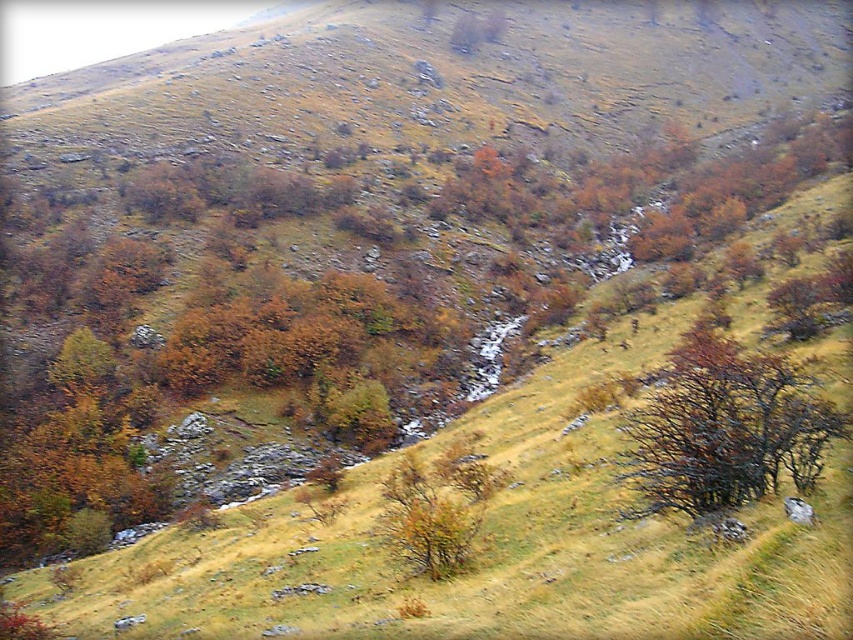
Can you confirm if brown matte tree at center-right is positioned to the left of green matte tree at center?

In fact, brown matte tree at center-right is to the right of green matte tree at center.

Between brown matte tree at center-right and green matte tree at center, which one has less height?

Standing shorter between the two is green matte tree at center.

Is point (805, 381) farther from camera compared to point (421, 525)?

Yes, it is behind point (421, 525).

Where is `brown matte tree at center-right`? brown matte tree at center-right is located at coordinates (724, 429).